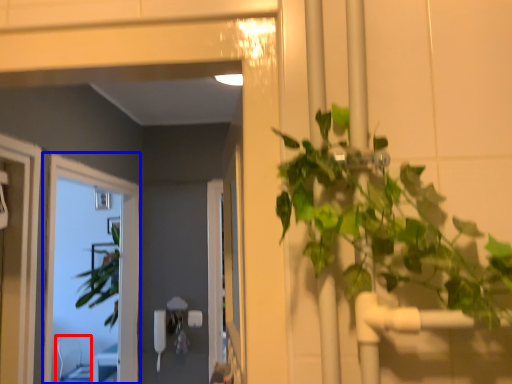
Question: Which point is closer to the camera, chair (highlighted by a red box) or window (highlighted by a blue box)?

Choices:
 (A) chair
 (B) window

Answer: (B)